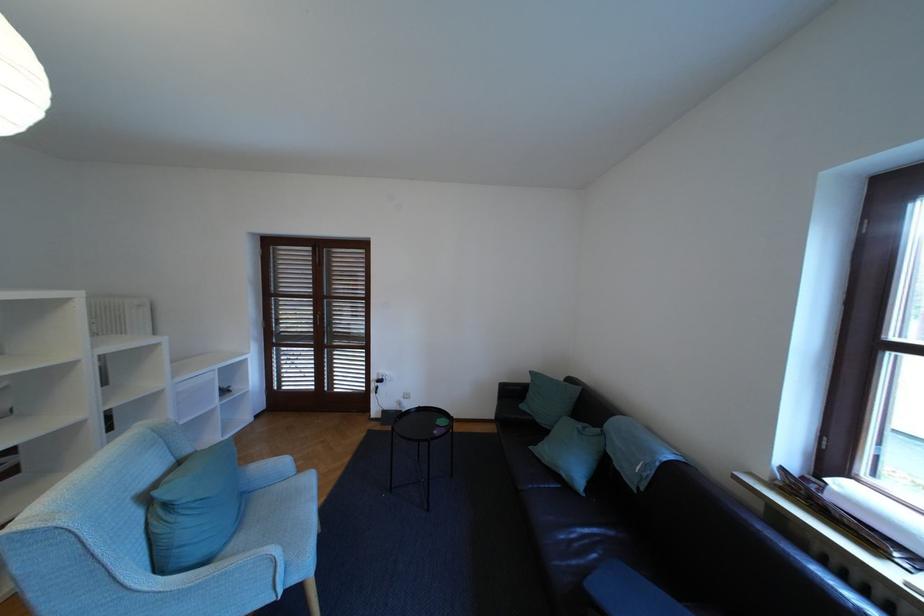
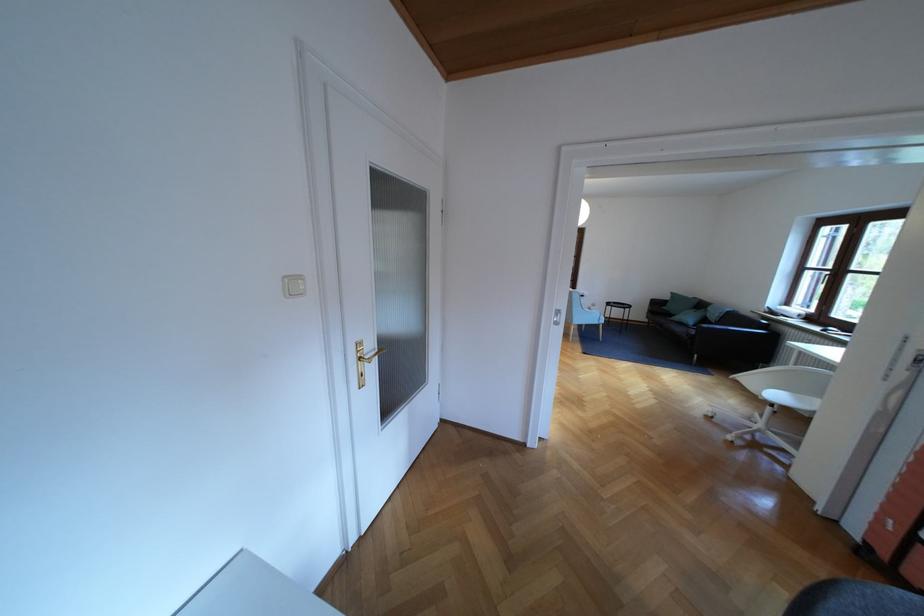
Which direction would the cameraman need to move to produce the second image?

The cameraman walked toward left, backward.